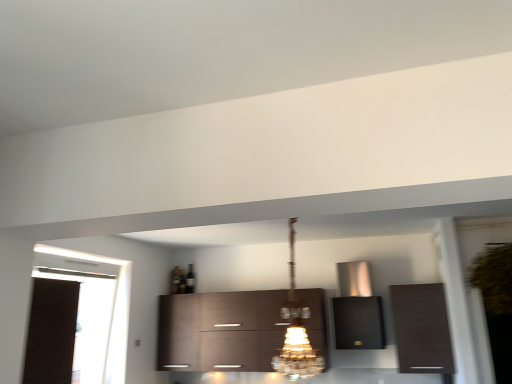
Question: Visually, is dark wood cabinet at right, which is the third cabinetry in left-to-right order, positioned to the left or to the right of black fabric curtain at left?

Choices:
 (A) left
 (B) right

Answer: (B)

Question: Is point (402, 296) closer or farther from the camera than point (119, 292)?

Choices:
 (A) farther
 (B) closer

Answer: (B)

Question: Estimate the real-world distances between objects in this image. Which object is closer to the black fabric curtain at left?

Choices:
 (A) dark wood cabinet at right, which is the third cabinetry in left-to-right order
 (B) satin metallic range hood at center, placed as the second cabinetry when sorted from right to left
 (C) dark wood cabinet at center, the first cabinetry viewed from the left
 (D) crystal glass chandelier at center

Answer: (C)

Question: Considering the real-world distances, which object is farthest from the satin metallic range hood at center, placed as the second cabinetry when sorted from right to left?

Choices:
 (A) dark wood cabinet at center, the first cabinetry viewed from the left
 (B) crystal glass chandelier at center
 (C) dark wood cabinet at right, the first cabinetry viewed from the right
 (D) black fabric curtain at left

Answer: (D)